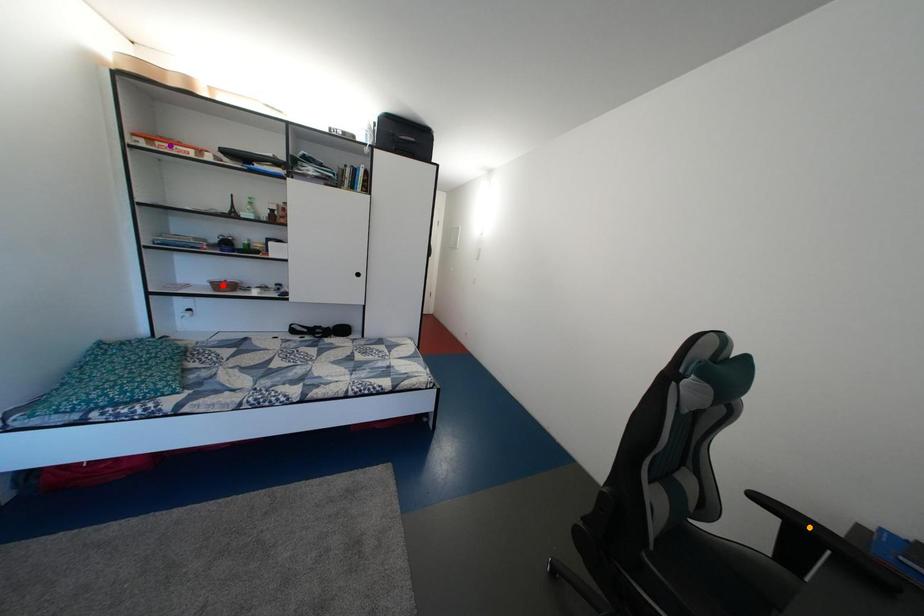
Based on the photo, order these from nearest to farthest:
- red point
- orange point
- purple point

orange point → purple point → red point